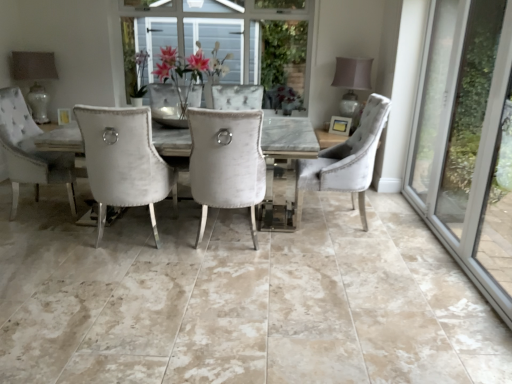
Find the location of a particular element. This screenshot has width=512, height=384. vacant space that is in between velvet white chair at center, which ranks as the first chair in left-to-right order, and velvet grey chair at right, the second chair in the left-to-right sequence is located at coordinates (294, 237).